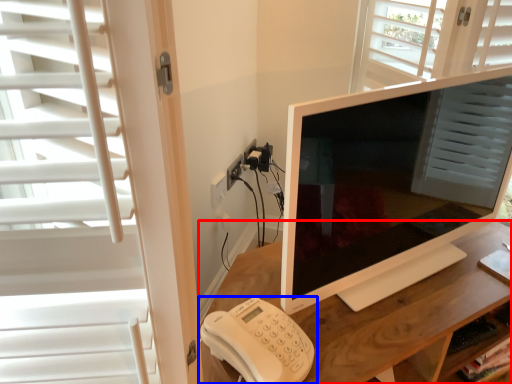
Question: Which object is closer to the camera taking this photo, desk (highlighted by a red box) or corded phone (highlighted by a blue box)?

Choices:
 (A) desk
 (B) corded phone

Answer: (B)